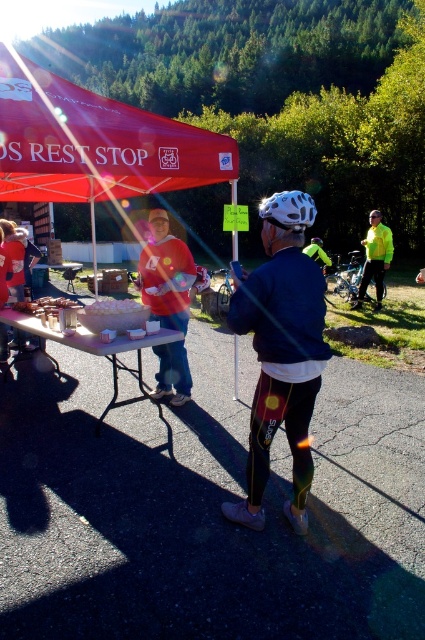
Can you confirm if red fabric canopy at upper left is thinner than white plastic table at center?

In fact, red fabric canopy at upper left might be wider than white plastic table at center.

Who is taller, red fabric canopy at upper left or white plastic table at center?

Standing taller between the two is red fabric canopy at upper left.

What do you see at coordinates (95, 141) in the screenshot? The width and height of the screenshot is (425, 640). I see `red fabric canopy at upper left` at bounding box center [95, 141].

This screenshot has width=425, height=640. I want to click on red fabric canopy at upper left, so click(x=95, y=141).

Is white paper plates at center above white plastic picnic table at center?

No, white paper plates at center is not above white plastic picnic table at center.

Between white paper plates at center and white plastic picnic table at center, which one is positioned higher?

Positioned higher is white plastic picnic table at center.

Does point (27, 307) come behind point (36, 273)?

No, (27, 307) is in front of (36, 273).

The height and width of the screenshot is (640, 425). In order to click on white paper plates at center in this screenshot , I will do `click(45, 305)`.

Is neon yellow jacket at center to the left of shiny silver helmet at center from the viewer's perspective?

In fact, neon yellow jacket at center is to the right of shiny silver helmet at center.

Is neon yellow jacket at center closer to the viewer compared to shiny silver helmet at center?

Yes, it is.

Between point (371, 252) and point (379, 300), which one is positioned in front?

Point (371, 252)

You are a GUI agent. You are given a task and a screenshot of the screen. Output one action in this format:
    pyautogui.click(x=<x>, y=<y>)
    Task: Click on the neon yellow jacket at center
    The height and width of the screenshot is (640, 425).
    Given the screenshot: What is the action you would take?
    pyautogui.click(x=374, y=259)